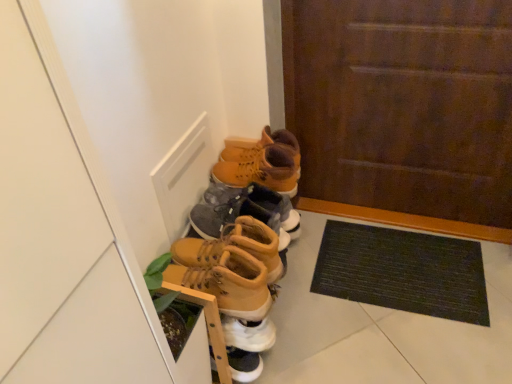
Question: Is brown wooden door at center turned away from matte brown boot at center, acting as the fourth footwear starting from the top?

Choices:
 (A) no
 (B) yes

Answer: (A)

Question: Considering the relative sizes of brown wooden door at center and matte brown boot at center, acting as the fourth footwear starting from the top, in the image provided, is brown wooden door at center shorter than matte brown boot at center, acting as the fourth footwear starting from the top,?

Choices:
 (A) no
 (B) yes

Answer: (A)

Question: Is brown wooden door at center not within matte brown boot at center, acting as the fourth footwear starting from the top?

Choices:
 (A) no
 (B) yes

Answer: (B)

Question: Can you confirm if brown wooden door at center is positioned to the right of matte brown boot at center, which appears as the second footwear when ordered from the bottom?

Choices:
 (A) no
 (B) yes

Answer: (B)

Question: Is brown wooden door at center positioned in front of matte brown boot at center, acting as the fourth footwear starting from the top?

Choices:
 (A) no
 (B) yes

Answer: (A)

Question: From a real-world perspective, is brown wooden door at center physically below matte brown boot at center, which appears as the second footwear when ordered from the bottom?

Choices:
 (A) no
 (B) yes

Answer: (A)

Question: Does matte yellow boots at center, which is the 4th footwear from bottom to top, appear on the left side of black rubber doormat at lower right?

Choices:
 (A) no
 (B) yes

Answer: (B)

Question: Is matte yellow boots at center, which ranks as the 2th footwear in top-to-bottom order, wider than black rubber doormat at lower right?

Choices:
 (A) no
 (B) yes

Answer: (A)

Question: Would you consider matte yellow boots at center, which ranks as the 2th footwear in top-to-bottom order, to be distant from black rubber doormat at lower right?

Choices:
 (A) yes
 (B) no

Answer: (B)

Question: Considering the relative sizes of matte yellow boots at center, which ranks as the 2th footwear in top-to-bottom order, and black rubber doormat at lower right in the image provided, is matte yellow boots at center, which ranks as the 2th footwear in top-to-bottom order, taller than black rubber doormat at lower right?

Choices:
 (A) no
 (B) yes

Answer: (B)

Question: From a real-world perspective, is matte yellow boots at center, which is the 4th footwear from bottom to top, on black rubber doormat at lower right?

Choices:
 (A) no
 (B) yes

Answer: (B)

Question: Considering the relative sizes of matte yellow boots at center, which is the 4th footwear from bottom to top, and black rubber doormat at lower right in the image provided, is matte yellow boots at center, which is the 4th footwear from bottom to top, thinner than black rubber doormat at lower right?

Choices:
 (A) no
 (B) yes

Answer: (B)

Question: From a real-world perspective, is matte yellow leather boots at center, positioned as the first footwear in top-to-bottom order, below matte yellow boots at center, which is the 4th footwear from bottom to top?

Choices:
 (A) no
 (B) yes

Answer: (A)